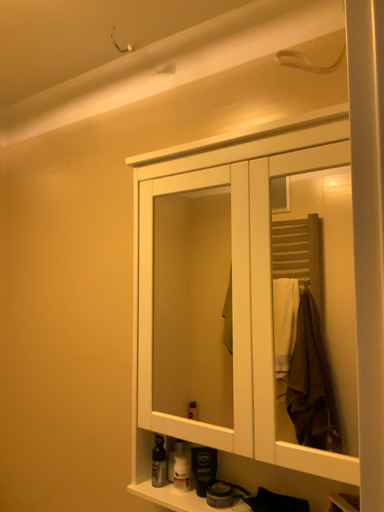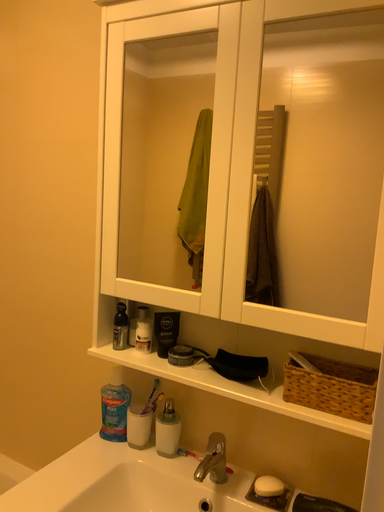
Question: How did the camera likely rotate when shooting the video?

Choices:
 (A) rotated left
 (B) rotated right

Answer: (B)